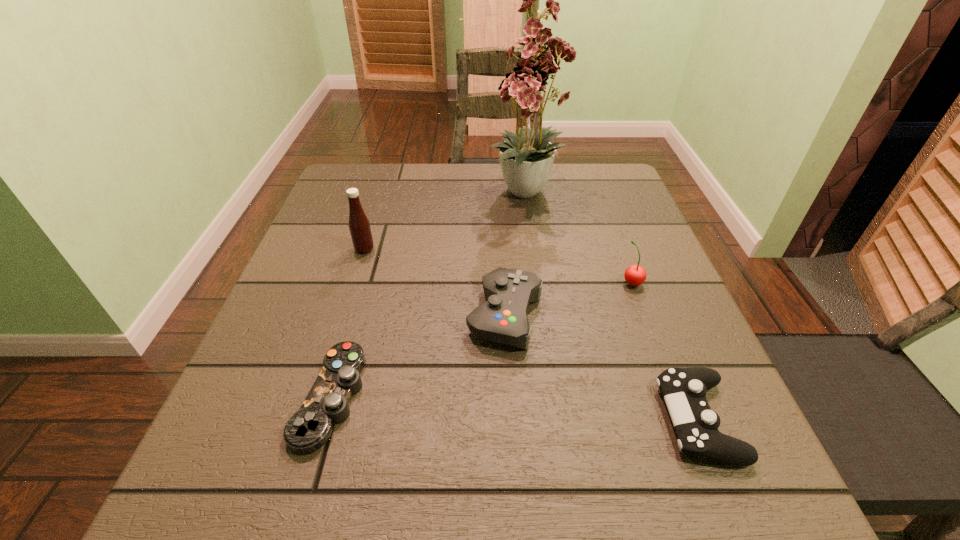
The image size is (960, 540). What are the coordinates of `the tallest object` in the screenshot? It's located at (524, 160).

Find the location of a particular element. flower arrangement is located at coordinates (524, 160).

Locate an element on the screen. This screenshot has height=540, width=960. the fifth nearest object is located at coordinates (359, 225).

Image resolution: width=960 pixels, height=540 pixels. I want to click on Tabasco sauce, so click(359, 225).

Identify the location of cherry. (635, 275).

This screenshot has height=540, width=960. I want to click on the tallest control, so click(503, 319).

Where is `the second control from left to right`? This screenshot has height=540, width=960. the second control from left to right is located at coordinates (503, 319).

This screenshot has height=540, width=960. What are the coordinates of `the rightmost control` in the screenshot? It's located at point(684,390).

This screenshot has width=960, height=540. I want to click on the fifth tallest object, so click(x=684, y=390).

What are the coordinates of `the shortest object` in the screenshot? It's located at click(x=308, y=429).